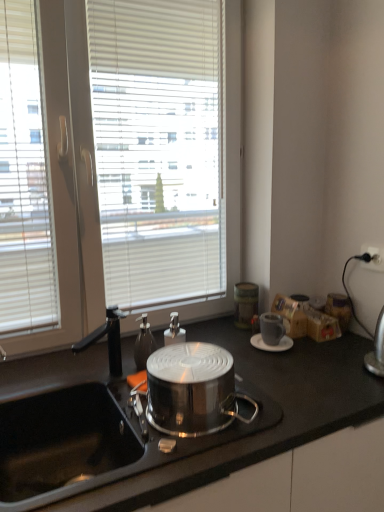
Question: Is translucent glass soap dispenser at center completely or partially inside matte gray cup at right?

Choices:
 (A) yes
 (B) no

Answer: (B)

Question: Are matte gray cup at right and translucent glass soap dispenser at center located far from each other?

Choices:
 (A) no
 (B) yes

Answer: (A)

Question: Is matte gray cup at right turned away from translucent glass soap dispenser at center?

Choices:
 (A) yes
 (B) no

Answer: (B)

Question: Is matte gray cup at right oriented towards translucent glass soap dispenser at center?

Choices:
 (A) no
 (B) yes

Answer: (A)

Question: From the image's perspective, is matte gray cup at right beneath translucent glass soap dispenser at center?

Choices:
 (A) no
 (B) yes

Answer: (B)

Question: Considering the positions of black matte countertop at center and wooden spice rack at right in the image, is black matte countertop at center taller or shorter than wooden spice rack at right?

Choices:
 (A) tall
 (B) short

Answer: (A)

Question: Do you think black matte countertop at center is within wooden spice rack at right, or outside of it?

Choices:
 (A) inside
 (B) outside

Answer: (B)

Question: From the image's perspective, is black matte countertop at center above or below wooden spice rack at right?

Choices:
 (A) below
 (B) above

Answer: (A)

Question: Visually, is black matte countertop at center positioned to the left or to the right of wooden spice rack at right?

Choices:
 (A) left
 (B) right

Answer: (A)

Question: Is black matte countertop at center bigger or smaller than white matte saucer at right?

Choices:
 (A) big
 (B) small

Answer: (A)

Question: In the image, is black matte countertop at center positioned in front of or behind white matte saucer at right?

Choices:
 (A) behind
 (B) front

Answer: (B)

Question: From the image's perspective, is black matte countertop at center above or below white matte saucer at right?

Choices:
 (A) below
 (B) above

Answer: (A)

Question: Choose the correct answer: Is black matte countertop at center inside white matte saucer at right or outside it?

Choices:
 (A) outside
 (B) inside

Answer: (A)

Question: Considering the relative positions of shiny metallic pot at center and black matte countertop at center in the image provided, is shiny metallic pot at center to the left or to the right of black matte countertop at center?

Choices:
 (A) left
 (B) right

Answer: (A)

Question: Based on their sizes in the image, would you say shiny metallic pot at center is bigger or smaller than black matte countertop at center?

Choices:
 (A) big
 (B) small

Answer: (B)